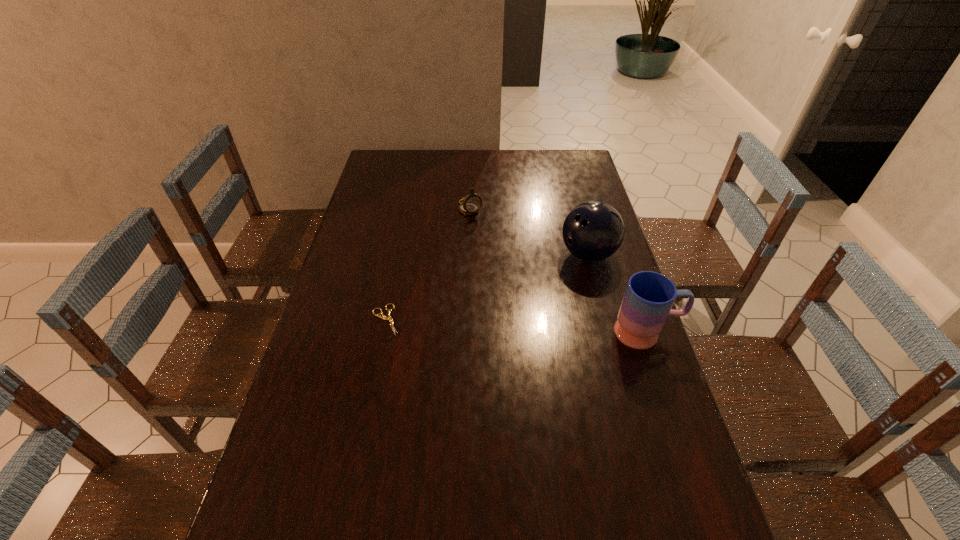
The height and width of the screenshot is (540, 960). I want to click on empty space that is in between the mug and the second farthest object, so click(x=617, y=293).

This screenshot has height=540, width=960. Find the location of `vacant space in between the farthest object and the leftmost object`. vacant space in between the farthest object and the leftmost object is located at coordinates (428, 264).

I want to click on free space between the compass and the mug, so click(x=559, y=271).

I want to click on vacant space that is in between the shortest object and the farthest object, so click(428, 264).

I want to click on vacant area that lies between the second object from left to right and the leftmost object, so click(x=428, y=264).

This screenshot has height=540, width=960. What are the coordinates of `vacant space in between the leftmost object and the mug` in the screenshot? It's located at (516, 326).

Where is `vacant area that lies between the mug and the third object from right to left`? Image resolution: width=960 pixels, height=540 pixels. vacant area that lies between the mug and the third object from right to left is located at coordinates (559, 271).

Locate an element on the screen. This screenshot has height=540, width=960. vacant area between the shears and the second shortest object is located at coordinates (428, 264).

Locate an element on the screen. free point between the mug and the second farthest object is located at coordinates (617, 293).

Point out which object is positioned as the second nearest to the leftmost object. Please provide its 2D coordinates. Your answer should be formatted as a tuple, i.e. [(x, y)], where the tuple contains the x and y coordinates of a point satisfying the conditions above.

[(593, 231)]